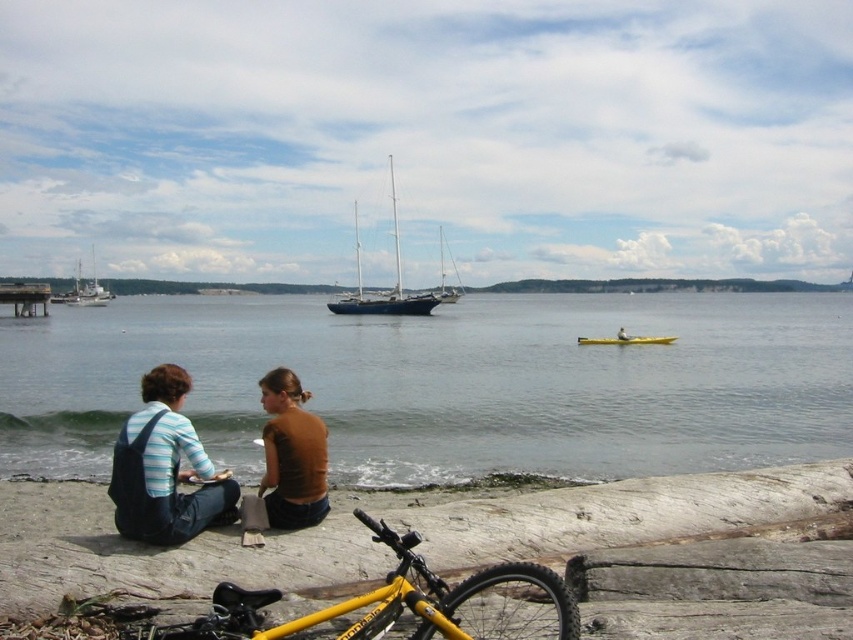
Is point (677, 435) farther from camera compared to point (86, 292)?

No, (677, 435) is in front of (86, 292).

Does clear water at lower left have a smaller size compared to white matte sailboat at left?

Actually, clear water at lower left might be larger than white matte sailboat at left.

The width and height of the screenshot is (853, 640). Find the location of `clear water at lower left`. clear water at lower left is located at coordinates (448, 384).

This screenshot has width=853, height=640. In order to click on clear water at lower left in this screenshot , I will do `click(448, 384)`.

Is smooth sand beach at lower left to the left of white matte sailboat at left from the viewer's perspective?

In fact, smooth sand beach at lower left is to the right of white matte sailboat at left.

Does smooth sand beach at lower left appear under white matte sailboat at left?

Yes, smooth sand beach at lower left is below white matte sailboat at left.

What do you see at coordinates (393, 528) in the screenshot?
I see `smooth sand beach at lower left` at bounding box center [393, 528].

I want to click on smooth sand beach at lower left, so click(x=393, y=528).

Is point (131, 298) behind point (674, 337)?

Yes, point (131, 298) is behind point (674, 337).

Is point (659, 458) positioned in front of point (602, 340)?

Yes, it is.

Find the location of `clear water at lower left`. clear water at lower left is located at coordinates (448, 384).